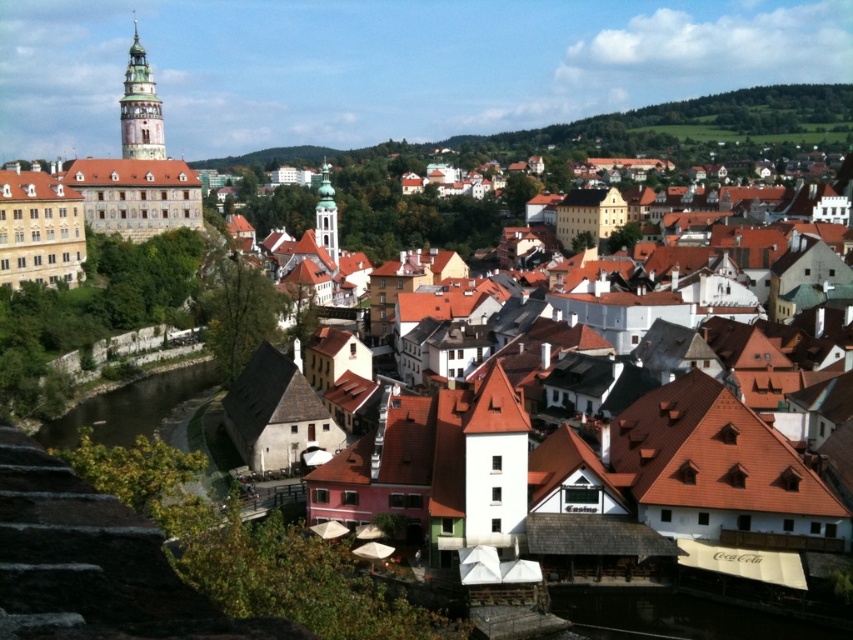
Question: Among these objects, which one is nearest to the camera?

Choices:
 (A) brown concrete river at lower left
 (B) brown tiled roofs at center
 (C) green stone tower at upper left

Answer: (B)

Question: Which object is positioned farthest from the brown tiled roofs at center?

Choices:
 (A) brown concrete river at lower left
 (B) green stone tower at upper left

Answer: (B)

Question: Is brown concrete river at lower left behind green glass tower at center?

Choices:
 (A) no
 (B) yes

Answer: (A)

Question: Is the position of brown tiled roofs at center less distant than that of green glass tower at center?

Choices:
 (A) yes
 (B) no

Answer: (A)

Question: Which is nearer to the brown concrete river at lower left?

Choices:
 (A) green stone tower at upper left
 (B) brown tiled roofs at center

Answer: (B)

Question: Can you confirm if brown concrete river at lower left is smaller than green stone tower at upper left?

Choices:
 (A) no
 (B) yes

Answer: (B)